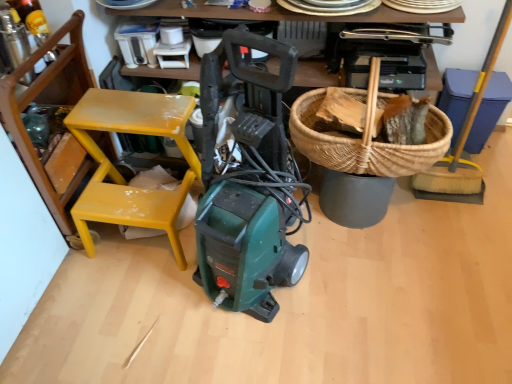
Where is `vacant area that is in front of yellow-bristled broom at right`? The height and width of the screenshot is (384, 512). vacant area that is in front of yellow-bristled broom at right is located at coordinates (462, 210).